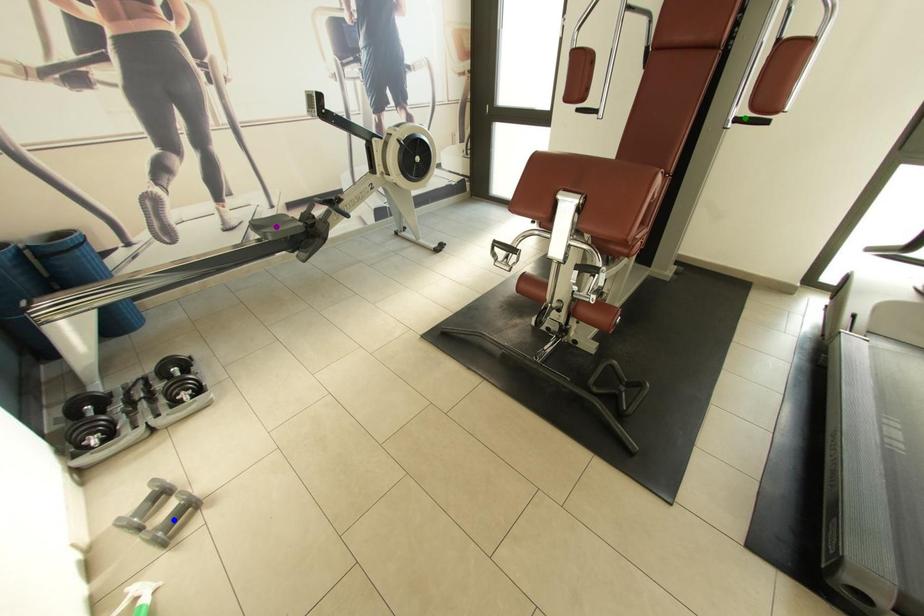
Order these from nearest to farthest:
blue point, purple point, green point

1. blue point
2. green point
3. purple point